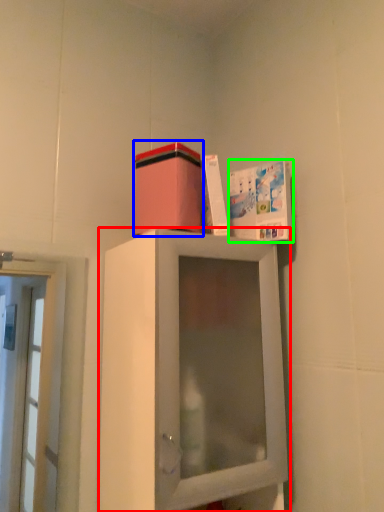
Question: Considering the real-world distances, which object is farthest from cabinetry (highlighted by a red box)? cardboard box (highlighted by a blue box) or book cover (highlighted by a green box)?

Choices:
 (A) cardboard box
 (B) book cover

Answer: (B)